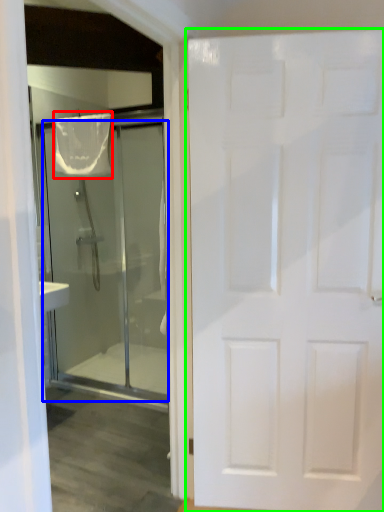
Question: Considering the real-world distances, which object is farthest from shower curtain (highlighted by a red box)? door (highlighted by a blue box) or door (highlighted by a green box)?

Choices:
 (A) door
 (B) door

Answer: (B)